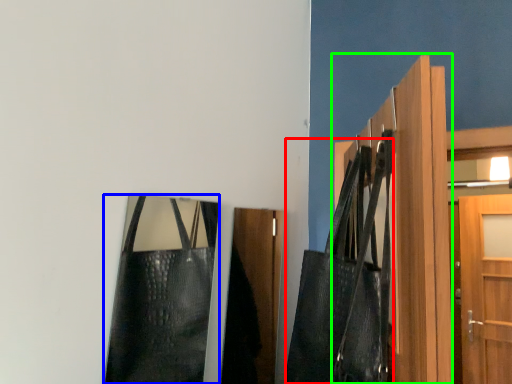
Question: Which is farther away from shoulder bag (highlighted by a red box)? bag (highlighted by a blue box) or door (highlighted by a green box)?

Choices:
 (A) bag
 (B) door

Answer: (A)